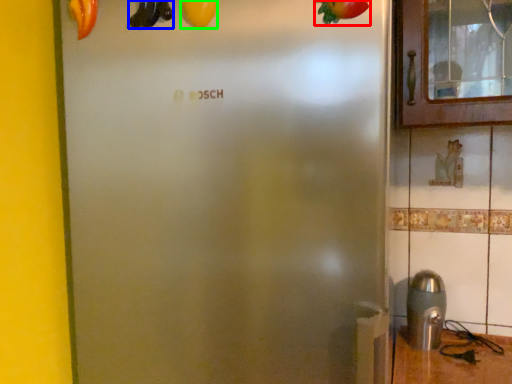
Question: Which is nearer to the fruit (highlighted by a red box)? banana (highlighted by a blue box) or fruit (highlighted by a green box).

Choices:
 (A) banana
 (B) fruit

Answer: (B)